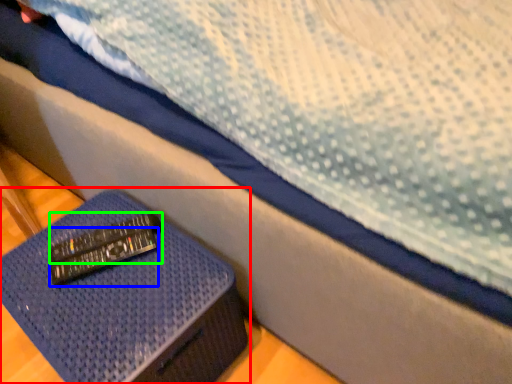
Question: Which object is positioned closest to furniture (highlighted by a red box)? Select from remote (highlighted by a blue box) and remote (highlighted by a green box).

Choices:
 (A) remote
 (B) remote

Answer: (A)